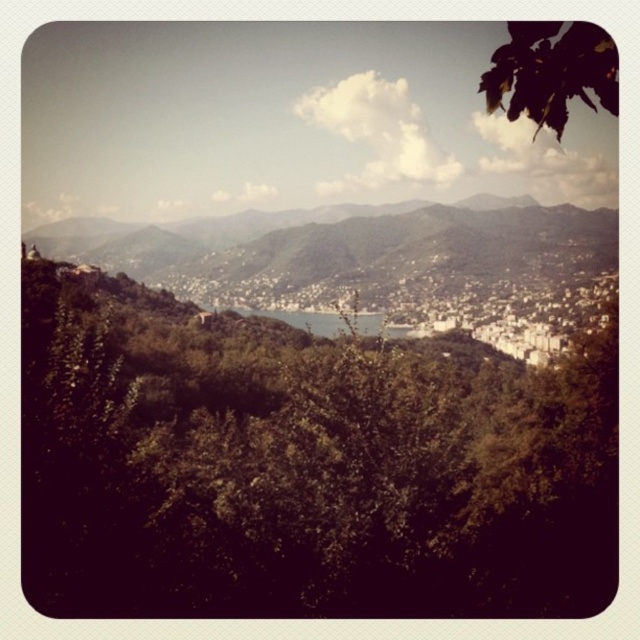
Question: Among these points, which one is farthest from the camera?

Choices:
 (A) (529, 492)
 (B) (371, 321)
 (C) (241, 244)

Answer: (C)

Question: Which point appears closest to the camera in this image?

Choices:
 (A) pos(328,317)
 (B) pos(310,305)
 (C) pos(557,102)
 (D) pos(22,502)

Answer: (C)

Question: Does green textured mountain at center appear under blue water at center?

Choices:
 (A) no
 (B) yes

Answer: (A)

Question: Observing the image, what is the correct spatial positioning of green leafy tree at lower left in reference to green textured mountain at center?

Choices:
 (A) above
 (B) below

Answer: (B)

Question: Is green leafy tree at lower left to the left of green textured mountain at center from the viewer's perspective?

Choices:
 (A) no
 (B) yes

Answer: (B)

Question: Which point is farther to the camera?

Choices:
 (A) blue water at center
 (B) green textured mountain at center

Answer: (B)